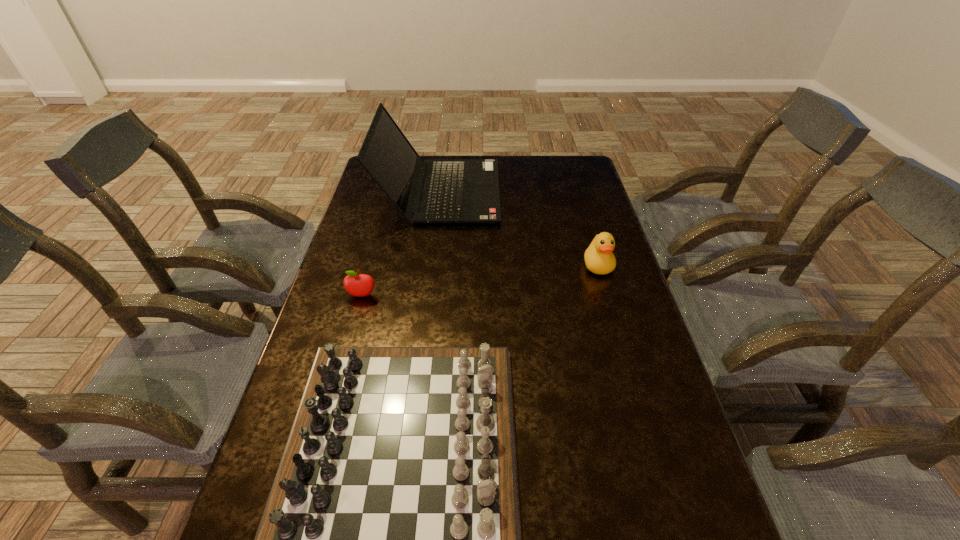
You are a GUI agent. You are given a task and a screenshot of the screen. Output one action in this format:
    pyautogui.click(x=<x>, y=<y>)
    Task: Click on the laptop computer present at the left edge
    The height and width of the screenshot is (540, 960).
    Given the screenshot: What is the action you would take?
    pyautogui.click(x=455, y=190)

Where is `apple at the left edge`? The width and height of the screenshot is (960, 540). apple at the left edge is located at coordinates (359, 285).

Identify the location of object that is at the right edge. (599, 259).

The image size is (960, 540). Identify the location of object at the far left corner. (455, 190).

This screenshot has height=540, width=960. I want to click on free space at the far edge of the desktop, so click(426, 156).

What are the coordinates of `free space at the left edge of the desktop` in the screenshot? It's located at pos(357,219).

You are a GUI agent. You are given a task and a screenshot of the screen. Output one action in this format:
    pyautogui.click(x=<x>, y=<y>)
    Task: Click on the vacant space at the right edge of the desktop
    The image size is (960, 540).
    Given the screenshot: What is the action you would take?
    pyautogui.click(x=618, y=406)

You are a GUI agent. You are given a task and a screenshot of the screen. Output one action in this format:
    pyautogui.click(x=<x>, y=<y>)
    Task: Click on the free space at the far right corner of the desktop
    This screenshot has height=540, width=960.
    Given the screenshot: What is the action you would take?
    pyautogui.click(x=570, y=156)

Image resolution: width=960 pixels, height=540 pixels. Identify the location of free space between the rightmost object and the apple. (480, 280).

Find the location of a particular element. vacant space that's between the tallest object and the second farthest object is located at coordinates (518, 228).